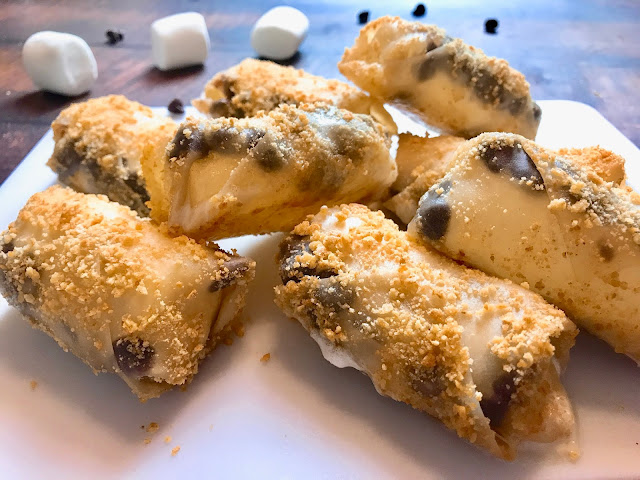
Where is `low lighting`? The width and height of the screenshot is (640, 480). low lighting is located at coordinates (608, 460).